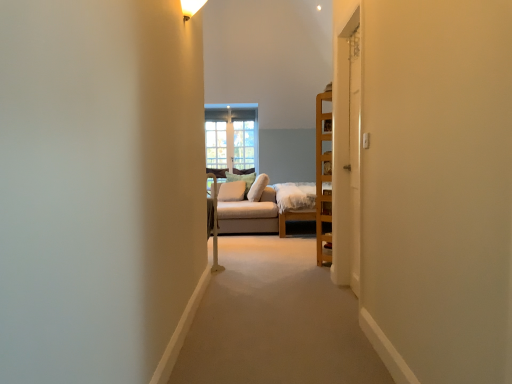
The image size is (512, 384). What do you see at coordinates (231, 191) in the screenshot? I see `soft beige cushion at center, marked as the second pillow in a back-to-front arrangement` at bounding box center [231, 191].

Locate an element on the screen. Image resolution: width=512 pixels, height=384 pixels. soft beige cushion at center, which ranks as the 1th pillow in front-to-back order is located at coordinates (231, 191).

In order to face white painted wood door at right, positioned as the first door in right-to-left order, should I rotate leftwards or rightwards?

You should look right and rotate roughly 13.756 degrees.

This screenshot has width=512, height=384. What do you see at coordinates (347, 155) in the screenshot? I see `white wooden door at center, which is the 1th door from left to right` at bounding box center [347, 155].

This screenshot has height=384, width=512. Identify the location of beige fabric couch at center. (247, 209).

What is the approximate height of clear glass window at center?

It is 4.89 feet.

Locate an element on the screen. soft beige cushion at center, marked as the second pillow in a back-to-front arrangement is located at coordinates (231, 191).

Is white painted wood door at right, the 2th door positioned from the left, positioned with its back to beige fabric couch at center?

No.

In the scene shown: Who is more distant, white painted wood door at right, the 2th door positioned from the left, or beige fabric couch at center?

beige fabric couch at center is further from the camera.

Is beige fabric couch at center smaller than soft beige pillow at center, which ranks as the 2th pillow in front-to-back order?

Actually, beige fabric couch at center might be larger than soft beige pillow at center, which ranks as the 2th pillow in front-to-back order.

Is beige fabric couch at center spatially inside soft beige pillow at center, the first pillow when ordered from back to front, or outside of it?

beige fabric couch at center lies outside soft beige pillow at center, the first pillow when ordered from back to front.

From a real-world perspective, who is located higher, beige fabric couch at center or soft beige pillow at center, which ranks as the 2th pillow in front-to-back order?

soft beige pillow at center, which ranks as the 2th pillow in front-to-back order, is physically above.

Considering the sizes of objects clear glass window at center and soft beige cushion at center, which ranks as the 1th pillow in front-to-back order, in the image provided, who is taller, clear glass window at center or soft beige cushion at center, which ranks as the 1th pillow in front-to-back order,?

Standing taller between the two is clear glass window at center.

Is clear glass window at center far from soft beige cushion at center, which ranks as the 1th pillow in front-to-back order?

Actually, clear glass window at center and soft beige cushion at center, which ranks as the 1th pillow in front-to-back order, are a little close together.

From a real-world perspective, which object rests below the other?

soft beige cushion at center, marked as the second pillow in a back-to-front arrangement, from a real-world perspective.

Which is more to the left, clear glass window at center or soft beige cushion at center, which ranks as the 1th pillow in front-to-back order?

Positioned to the left is clear glass window at center.

Considering the positions of objects clear glass window at center and beige fabric couch at center in the image provided, who is behind, clear glass window at center or beige fabric couch at center?

clear glass window at center is behind.

Considering the relative sizes of clear glass window at center and beige fabric couch at center in the image provided, is clear glass window at center bigger than beige fabric couch at center?

No, clear glass window at center is not bigger than beige fabric couch at center.

Considering the sizes of objects clear glass window at center and beige fabric couch at center in the image provided, who is taller, clear glass window at center or beige fabric couch at center?

clear glass window at center.

Is clear glass window at center spatially inside beige fabric couch at center, or outside of it?

→ clear glass window at center cannot be found inside beige fabric couch at center.

Considering the sizes of objects white painted wood door at right, the 2th door positioned from the left, and clear glass window at center in the image provided, who is bigger, white painted wood door at right, the 2th door positioned from the left, or clear glass window at center?

Bigger between the two is clear glass window at center.

From the image's perspective, does white painted wood door at right, the 2th door positioned from the left, appear higher than clear glass window at center?

Actually, white painted wood door at right, the 2th door positioned from the left, appears below clear glass window at center in the image.

Are white painted wood door at right, positioned as the first door in right-to-left order, and clear glass window at center located far from each other?

Yes, white painted wood door at right, positioned as the first door in right-to-left order, and clear glass window at center are quite far apart.

Based on their positions, is white painted wood door at right, the 2th door positioned from the left, located to the left or right of clear glass window at center?

In the image, white painted wood door at right, the 2th door positioned from the left, appears on the right side of clear glass window at center.

Where is `the 2nd pillow below the white wooden door at center, the 2th door viewed from the right (from a real-world perspective)`? The height and width of the screenshot is (384, 512). the 2nd pillow below the white wooden door at center, the 2th door viewed from the right (from a real-world perspective) is located at coordinates [x=231, y=191].

Is the position of white wooden door at center, the 2th door viewed from the right, less distant than that of soft beige cushion at center, marked as the second pillow in a back-to-front arrangement?

Yes, white wooden door at center, the 2th door viewed from the right, is in front of soft beige cushion at center, marked as the second pillow in a back-to-front arrangement.

From the image's perspective, who appears lower, white wooden door at center, which is the 1th door from left to right, or soft beige cushion at center, marked as the second pillow in a back-to-front arrangement?

soft beige cushion at center, marked as the second pillow in a back-to-front arrangement, is shown below in the image.

Which point is more forward, (358, 287) or (226, 200)?

The point (358, 287) is more forward.

Considering the relative sizes of soft beige cushion at center, marked as the second pillow in a back-to-front arrangement, and clear glass window at center in the image provided, is soft beige cushion at center, marked as the second pillow in a back-to-front arrangement, thinner than clear glass window at center?

No, soft beige cushion at center, marked as the second pillow in a back-to-front arrangement, is not thinner than clear glass window at center.

From a real-world perspective, is soft beige cushion at center, which ranks as the 1th pillow in front-to-back order, physically located above or below clear glass window at center?

soft beige cushion at center, which ranks as the 1th pillow in front-to-back order, is situated lower than clear glass window at center in the real world.

Is soft beige cushion at center, which ranks as the 1th pillow in front-to-back order, beside clear glass window at center?

No, soft beige cushion at center, which ranks as the 1th pillow in front-to-back order, is not touching clear glass window at center.

Does soft beige cushion at center, marked as the second pillow in a back-to-front arrangement, have a lesser height compared to clear glass window at center?

Correct, soft beige cushion at center, marked as the second pillow in a back-to-front arrangement, is not as tall as clear glass window at center.

There is a beige fabric couch at center. At what (x,y) coordinates should I click in order to perform the action: click on the 1st door above it (from a real-world perspective). Please return your answer as a coordinate pair (x, y). The height and width of the screenshot is (384, 512). Looking at the image, I should click on (355, 154).

The height and width of the screenshot is (384, 512). In order to click on studio couch to the right of soft beige pillow at center, the first pillow when ordered from back to front in this screenshot , I will do `click(247, 209)`.

Looking at the image, which one is located closer to soft beige pillow at center, the first pillow when ordered from back to front, white wooden door at center, which is the 1th door from left to right, or soft beige cushion at center, which ranks as the 1th pillow in front-to-back order?

soft beige cushion at center, which ranks as the 1th pillow in front-to-back order, is positioned closer to the anchor soft beige pillow at center, the first pillow when ordered from back to front.

From the image, which object appears to be nearer to white painted wood door at right, positioned as the first door in right-to-left order, soft beige cushion at center, which ranks as the 1th pillow in front-to-back order, or clear glass window at center?

soft beige cushion at center, which ranks as the 1th pillow in front-to-back order, is closer to white painted wood door at right, positioned as the first door in right-to-left order.

Estimate the real-world distances between objects in this image. Which object is closer to soft beige cushion at center, which ranks as the 1th pillow in front-to-back order, white wooden door at center, the 2th door viewed from the right, or white painted wood door at right, the 2th door positioned from the left?

Based on the image, white wooden door at center, the 2th door viewed from the right, appears to be nearer to soft beige cushion at center, which ranks as the 1th pillow in front-to-back order.

Estimate the real-world distances between objects in this image. Which object is further from clear glass window at center, soft beige cushion at center, marked as the second pillow in a back-to-front arrangement, or white wooden door at center, which is the 1th door from left to right?

white wooden door at center, which is the 1th door from left to right, is positioned further to the anchor clear glass window at center.

Looking at the image, which one is located closer to soft beige pillow at center, which ranks as the 2th pillow in front-to-back order, beige fabric couch at center or white painted wood door at right, positioned as the first door in right-to-left order?

→ beige fabric couch at center.

Looking at the image, which one is located further to white wooden door at center, which is the 1th door from left to right, soft beige pillow at center, which ranks as the 2th pillow in front-to-back order, or clear glass window at center?

clear glass window at center lies further to white wooden door at center, which is the 1th door from left to right, than the other object.

Considering their positions, is white painted wood door at right, positioned as the first door in right-to-left order, positioned closer to soft beige pillow at center, the first pillow when ordered from back to front, than soft beige cushion at center, marked as the second pillow in a back-to-front arrangement?

Based on the image, soft beige cushion at center, marked as the second pillow in a back-to-front arrangement, appears to be nearer to soft beige pillow at center, the first pillow when ordered from back to front.

Which object lies nearer to the anchor point beige fabric couch at center, clear glass window at center or soft beige pillow at center, the first pillow when ordered from back to front?

The object closer to beige fabric couch at center is soft beige pillow at center, the first pillow when ordered from back to front.

Image resolution: width=512 pixels, height=384 pixels. In order to click on door between white wooden door at center, which is the 1th door from left to right, and clear glass window at center in the front-back direction in this screenshot , I will do `click(355, 154)`.

You are a GUI agent. You are given a task and a screenshot of the screen. Output one action in this format:
    pyautogui.click(x=<x>, y=<y>)
    Task: Click on the door between white wooden door at center, which is the 1th door from left to right, and beige fabric couch at center, along the z-axis
    Image resolution: width=512 pixels, height=384 pixels.
    Given the screenshot: What is the action you would take?
    pos(355,154)

Identify the location of pillow between white painted wood door at right, positioned as the first door in right-to-left order, and soft beige pillow at center, which ranks as the 2th pillow in front-to-back order, in the front-back direction. (231, 191).

The height and width of the screenshot is (384, 512). What are the coordinates of `door located between white wooden door at center, the 2th door viewed from the right, and soft beige cushion at center, marked as the second pillow in a back-to-front arrangement, in the depth direction` in the screenshot? It's located at (355, 154).